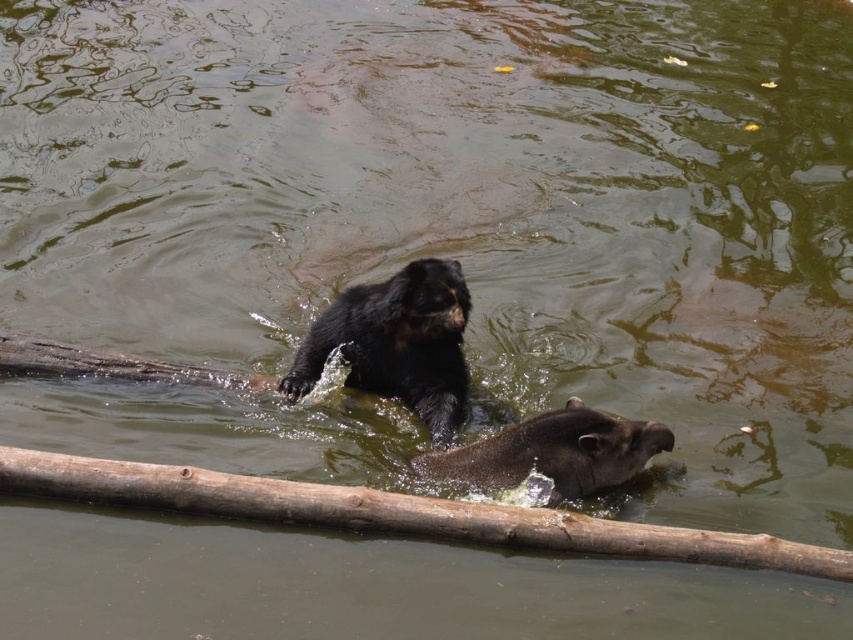
Is black furry bear at upper center taller than brown fuzzy tapir at lower center?

Correct, black furry bear at upper center is much taller as brown fuzzy tapir at lower center.

Does black furry bear at upper center have a smaller size compared to brown fuzzy tapir at lower center?

Incorrect, black furry bear at upper center is not smaller in size than brown fuzzy tapir at lower center.

Who is more distant from viewer, [409,316] or [590,492]?

The point [409,316] is more distant.

At what (x,y) coordinates should I click in order to perform the action: click on black furry bear at upper center. Please return your answer as a coordinate pair (x, y). Looking at the image, I should click on (396, 342).

Is brown rough wood at center in front of black furry bear at upper center?

Yes, it is.

Does point (316, 515) lie behind point (444, 381)?

No.

The width and height of the screenshot is (853, 640). What do you see at coordinates (396, 513) in the screenshot?
I see `brown rough wood at center` at bounding box center [396, 513].

This screenshot has height=640, width=853. What are the coordinates of `brown rough wood at center` in the screenshot? It's located at (396, 513).

Is point (653, 552) farther from camera compared to point (625, 454)?

No, it is not.

Who is taller, brown rough wood at center or brown fuzzy tapir at lower center?

brown rough wood at center is taller.

Locate an element on the screen. This screenshot has width=853, height=640. brown rough wood at center is located at coordinates (396, 513).